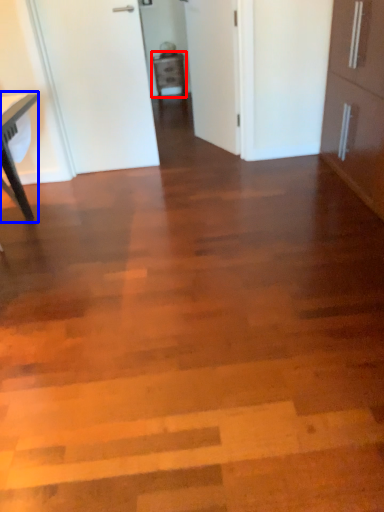
Question: Which object is closer to the camera taking this photo, cabinetry (highlighted by a red box) or table (highlighted by a blue box)?

Choices:
 (A) cabinetry
 (B) table

Answer: (B)